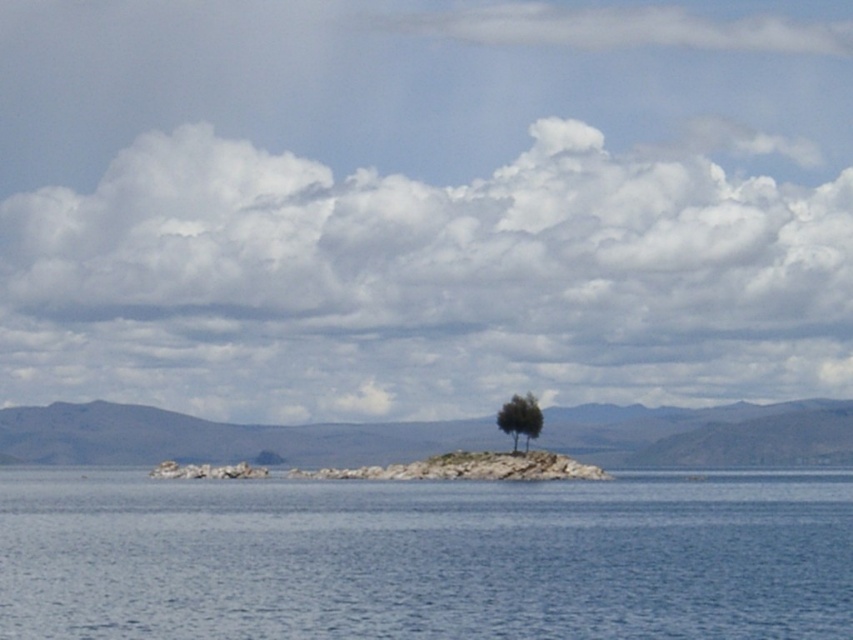
You are a photographer planning to capture the entire scene of the clear blue water at center and the green leafy tree at center in one frame. Given that your camera has a limited field of view, which object should you focus on to ensure both are visible without cropping?

The clear blue water at center is larger in size than the green leafy tree at center, so focusing on the clear blue water at center would ensure both objects are visible in the frame since it occupies more space in the scene.

You are a drone operator who needs to fly a drone from the clear blue water at center to the green leafy tree at center. The drone has a maximum range of 50 meters. Can the drone reach the tree from the water without needing to recharge?

The clear blue water at center and green leafy tree at center are 51.89 meters apart. Since the distance exceeds the drone maximum range of 50 meters, the drone cannot reach the tree from the water without needing to recharge.

You are a drone operator trying to capture the island with the tree from two specific points. You have to fly your drone to point A at coordinates point (393, 618) and point B at coordinates point (521, 412). Which point will require the drone to be closer to the ground to maintain the same view of the island?

Point point (521, 412) will require the drone to be closer to the ground because it is further from the camera compared to point point (393, 618), which is closer. To maintain the same view of the island, the drone at point point (521, 412) needs to descend lower to keep the island in frame.